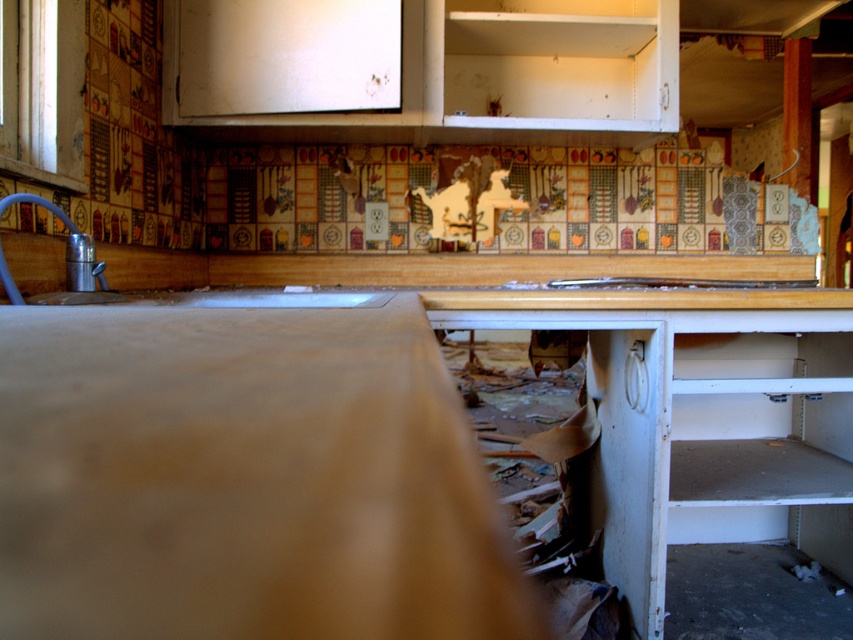
Does matte wood counter top at center come in front of silver metallic faucet at left?

Yes.

Between point (419, 584) and point (70, 289), which one is positioned behind?

Positioned behind is point (70, 289).

Does point (305, 522) come farther from viewer compared to point (4, 285)?

No, (305, 522) is in front of (4, 285).

At what (x,y) coordinates should I click in order to perform the action: click on matte wood counter top at center. Please return your answer as a coordinate pair (x, y). Looking at the image, I should click on (242, 477).

In the scene shown: Can you confirm if matte wood counter top at center is thinner than white matte cabinet at upper center?

Indeed, matte wood counter top at center has a lesser width compared to white matte cabinet at upper center.

You are a GUI agent. You are given a task and a screenshot of the screen. Output one action in this format:
    pyautogui.click(x=<x>, y=<y>)
    Task: Click on the matte wood counter top at center
    This screenshot has width=853, height=640.
    Given the screenshot: What is the action you would take?
    pyautogui.click(x=242, y=477)

Identify the location of matte wood counter top at center. (242, 477).

What are the coordinates of `matte wood counter top at center` in the screenshot? It's located at (242, 477).

This screenshot has height=640, width=853. What do you see at coordinates (560, 65) in the screenshot?
I see `white matte cabinet at upper center` at bounding box center [560, 65].

Who is taller, white matte cabinet at upper center or silver metallic faucet at left?

white matte cabinet at upper center

Between point (572, 92) and point (77, 272), which one is positioned in front?

Point (77, 272)

The width and height of the screenshot is (853, 640). Identify the location of white matte cabinet at upper center. (560, 65).